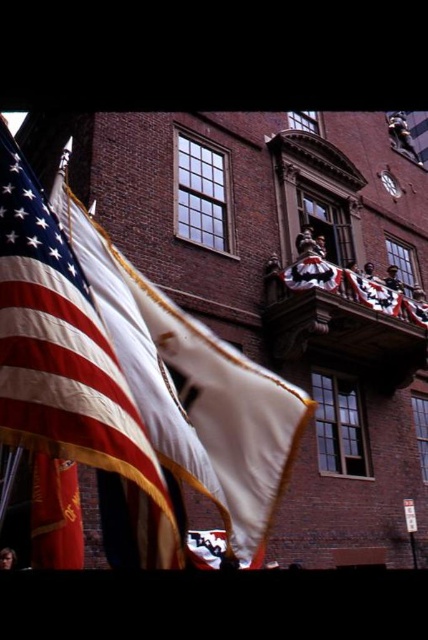
You are standing at the base of the historic brick building and want to take a photo of both the point at coordinates point (243, 358) and point (80, 552). To ensure both points are in focus, which point should you focus on first?

You should focus on point (80, 552) first because point (243, 358) is behind it, so focusing on the closer point ensures both are in focus.

In the scene shown: You are a photographer planning to capture both the matte white flag at left and the red satin flag at lower left in a single frame. Given their sizes, which flag should you position closer to the camera to ensure both appear balanced in the photo?

The matte white flag at left is larger in size than the red satin flag at lower left. To balance their appearance in the photo, you should position the smaller red satin flag at lower left closer to the camera while keeping the larger matte white flag at left farther back.